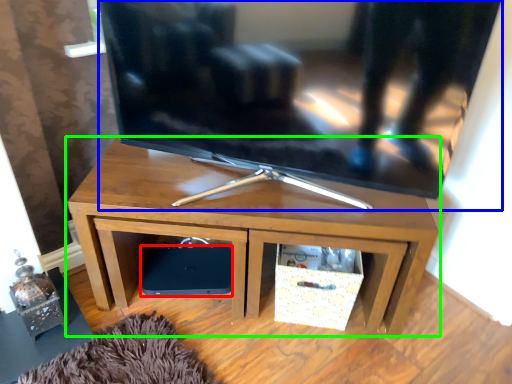
Question: Which object is the farthest from speaker (highlighted by a red box)? Choose among these: television (highlighted by a blue box) or desk (highlighted by a green box).

Choices:
 (A) television
 (B) desk

Answer: (A)